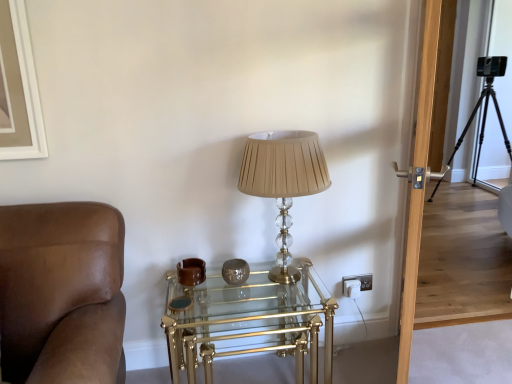
Question: Based on their positions, is clear glass/golden metal table at center located to the left or right of transparent wooden door at right?

Choices:
 (A) left
 (B) right

Answer: (A)

Question: Would you say clear glass/golden metal table at center is inside or outside transparent wooden door at right?

Choices:
 (A) outside
 (B) inside

Answer: (A)

Question: Which object is the closest to the clear glass/golden metal table at center?

Choices:
 (A) black metal tripod at right
 (B) transparent wooden door at right
 (C) translucent beige lampshade at center

Answer: (C)

Question: Which object is the farthest from the clear glass/golden metal table at center?

Choices:
 (A) translucent beige lampshade at center
 (B) transparent wooden door at right
 (C) black metal tripod at right

Answer: (C)